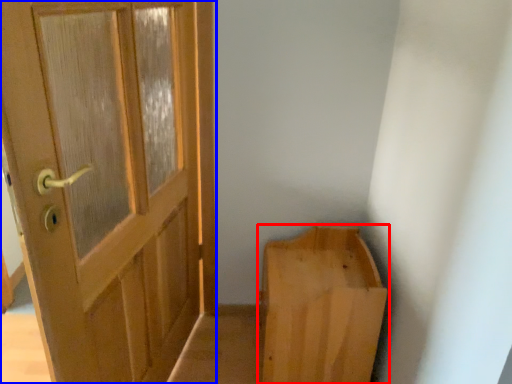
Question: Which object appears farthest to the camera in this image, furniture (highlighted by a red box) or door (highlighted by a blue box)?

Choices:
 (A) furniture
 (B) door

Answer: (A)